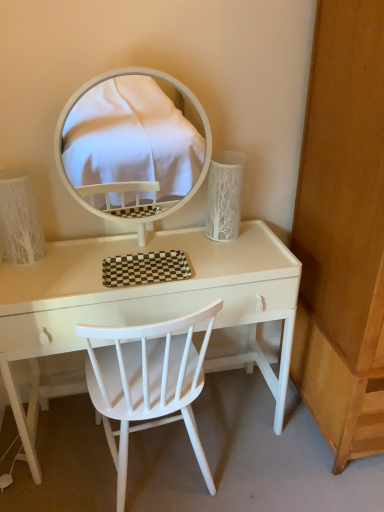
The height and width of the screenshot is (512, 384). I want to click on vacant area on top of white glossy table at center (from a real-world perspective), so click(x=165, y=258).